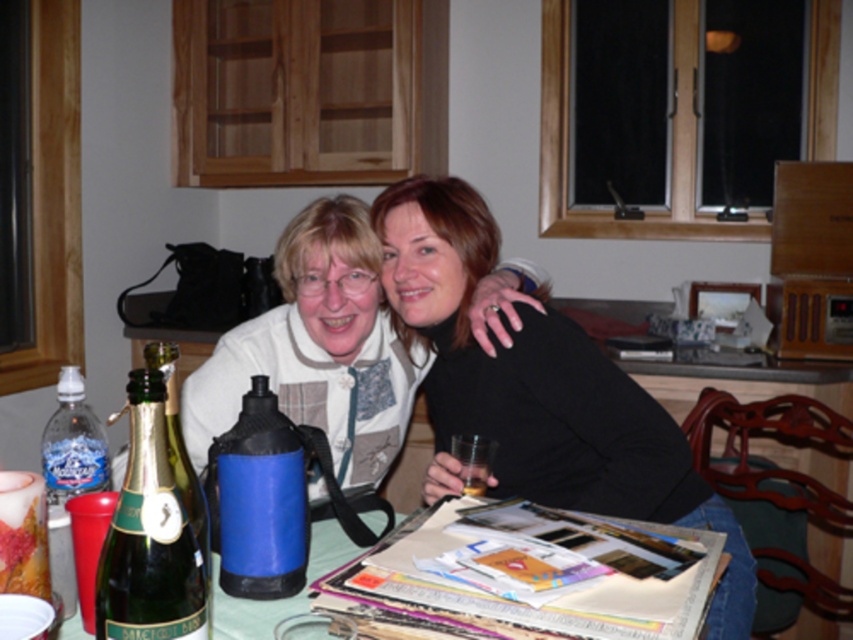
Question: Which point is farther from the camera taking this photo?

Choices:
 (A) (228, 538)
 (B) (131, 420)
 (C) (70, 429)

Answer: (C)

Question: Does printed paper magazine at table center have a smaller size compared to blue matte water bottle at center?

Choices:
 (A) no
 (B) yes

Answer: (A)

Question: Which point is farther from the camera taking this photo?

Choices:
 (A) (235, 580)
 (B) (114, 637)
 (C) (456, 435)
 (D) (434, 545)

Answer: (C)

Question: Which object is positioned farthest from the black matte sweater at center?

Choices:
 (A) blue matte water bottle at center
 (B) transparent glass at center
 (C) printed paper magazine at table center
 (D) clear plastic bottle at lower left

Answer: (D)

Question: From the image, what is the correct spatial relationship of black matte sweater at center in relation to transparent glass at center?

Choices:
 (A) right
 (B) left

Answer: (A)

Question: Does printed paper magazine at table center have a lesser width compared to blue matte water bottle at center?

Choices:
 (A) no
 (B) yes

Answer: (A)